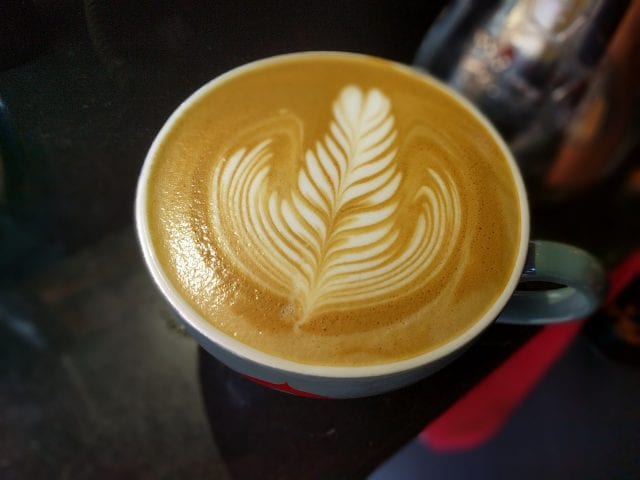
Locate an element on the screen. red light is located at coordinates (497, 406).